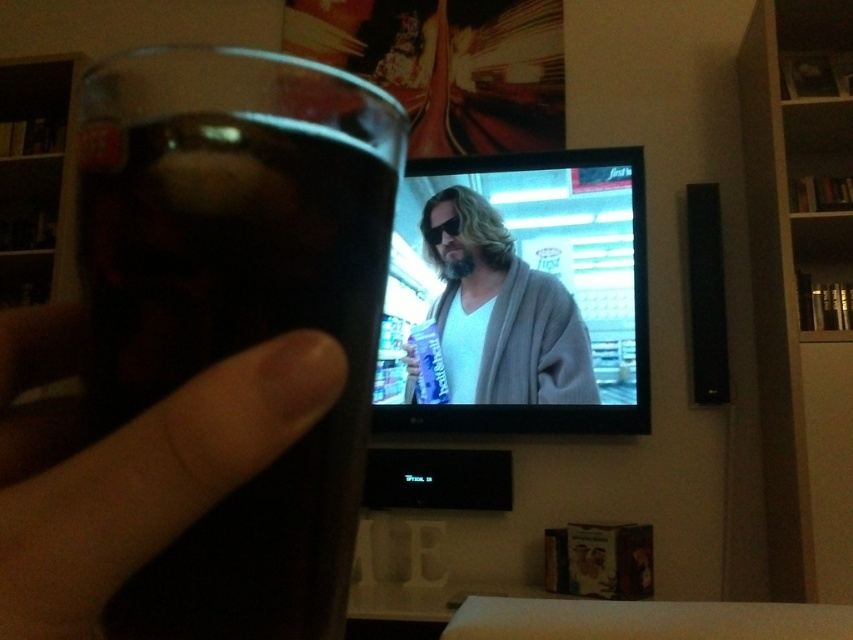
Question: From the image, what is the correct spatial relationship of translucent glass at center in relation to translucent plastic finger at lower left?

Choices:
 (A) left
 (B) right

Answer: (B)

Question: Does translucent glass at center have a lesser width compared to translucent plastic finger at lower left?

Choices:
 (A) no
 (B) yes

Answer: (A)

Question: Which object is farther from the camera taking this photo?

Choices:
 (A) matte gray bathrobe at center
 (B) translucent glass at center

Answer: (A)

Question: Which of the following is the farthest from the observer?

Choices:
 (A) click(578, 400)
 (B) click(167, 449)
 (C) click(157, 372)

Answer: (A)

Question: Which point is closer to the camera?

Choices:
 (A) (x=97, y=228)
 (B) (x=547, y=275)
 (C) (x=111, y=497)

Answer: (C)

Question: Does translucent glass at center have a lesser width compared to matte gray bathrobe at center?

Choices:
 (A) no
 (B) yes

Answer: (B)